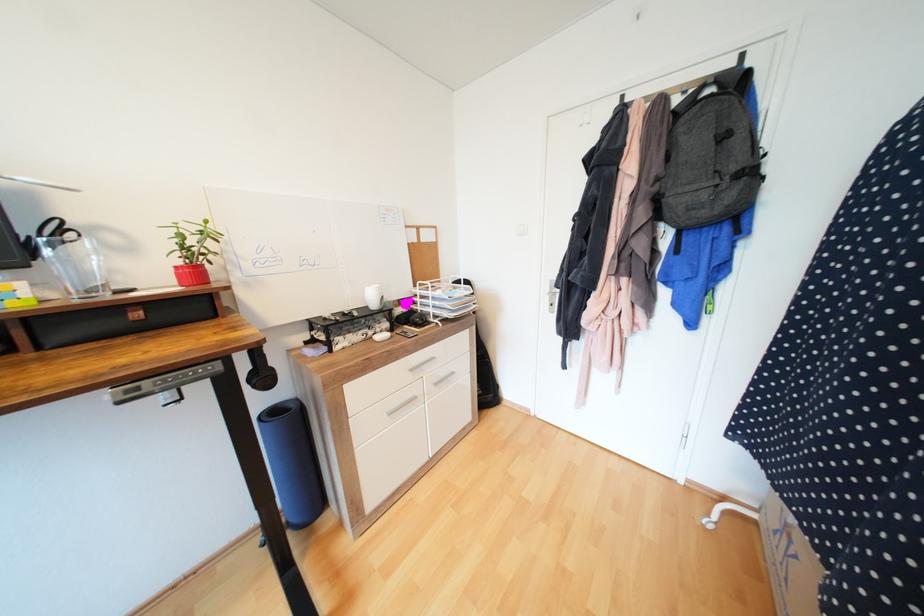
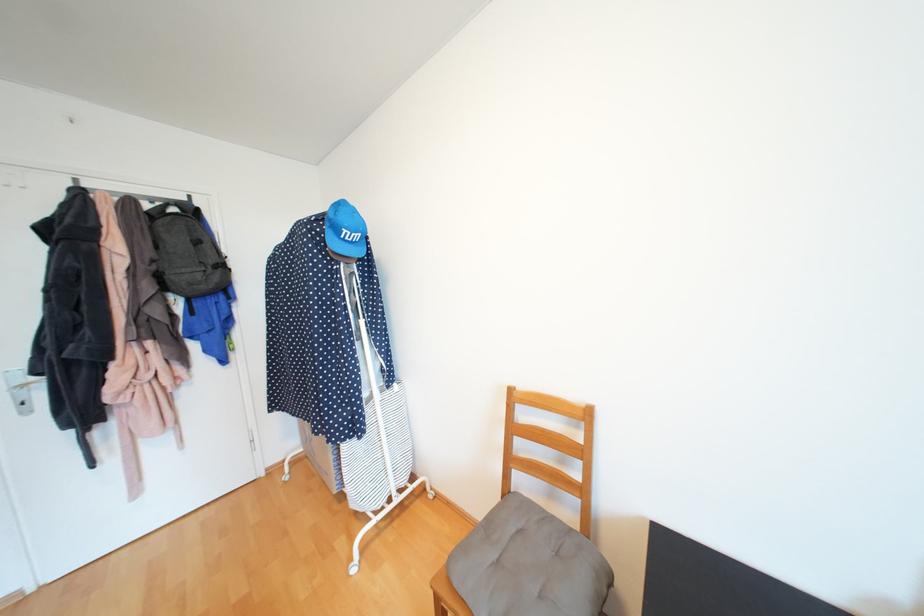
Find the pixel in the second image that matches the point at 561,294 in the first image.

(30, 387)